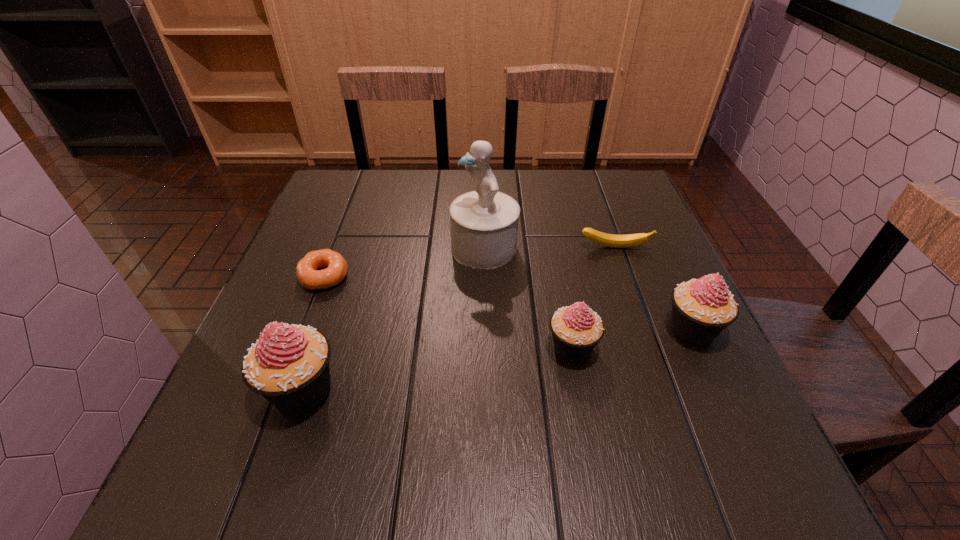
Identify the location of vacant space that's between the banana and the third tallest object. [x=653, y=289].

Find the location of `free space between the banana and the leftmost cupcake`. free space between the banana and the leftmost cupcake is located at coordinates (458, 319).

Where is `empty location between the leftmost cupcake and the banana`? The image size is (960, 540). empty location between the leftmost cupcake and the banana is located at coordinates (458, 319).

Locate an element on the screen. vacant space that's between the fourth tallest object and the banana is located at coordinates (593, 298).

The width and height of the screenshot is (960, 540). What are the coordinates of `empty space that is in between the leftmost cupcake and the figurine` in the screenshot? It's located at (393, 319).

I want to click on empty space between the third shortest object and the leftmost cupcake, so click(437, 369).

In order to click on free space between the second shortest object and the fourth shortest object in this screenshot , I will do `click(653, 289)`.

What are the coordinates of `free area in between the leftmost cupcake and the second shortest cupcake` in the screenshot? It's located at (496, 360).

Identify which object is the second nearest to the leftmost cupcake. Please provide its 2D coordinates. Your answer should be formatted as a tuple, i.e. [(x, y)], where the tuple contains the x and y coordinates of a point satisfying the conditions above.

[(484, 223)]

Where is `object that stands as the fifth closest to the fifth tallest object`? The image size is (960, 540). object that stands as the fifth closest to the fifth tallest object is located at coordinates pos(289,365).